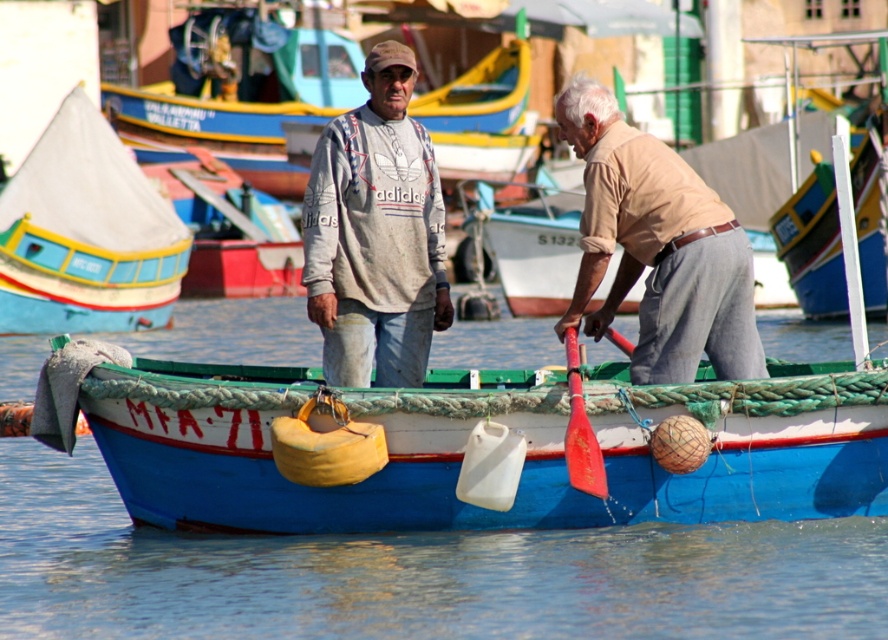
Question: Among these objects, which one is nearest to the camera?

Choices:
 (A) blue painted wooden boat at center
 (B) matte blue boat at left
 (C) beige cotton shirt at right
 (D) blue painted wood boat at center

Answer: (D)

Question: Is blue painted wooden boat at center bigger than matte brown boat at center?

Choices:
 (A) yes
 (B) no

Answer: (B)

Question: Which is farther from the matte blue boat at left?

Choices:
 (A) beige cotton shirt at right
 (B) blue painted wood boat at center
 (C) gray cotton sweatshirt at center
 (D) wooden boat at upper center

Answer: (A)

Question: Among these objects, which one is nearest to the camera?

Choices:
 (A) blue painted wood boat at center
 (B) gray cotton sweatshirt at center
 (C) blue painted wooden boat at center

Answer: (A)

Question: Is beige cotton shirt at right bigger than matte blue boat at left?

Choices:
 (A) no
 (B) yes

Answer: (A)

Question: Where is matte blue boat at left located in relation to wooden boat at upper center in the image?

Choices:
 (A) right
 (B) left

Answer: (B)